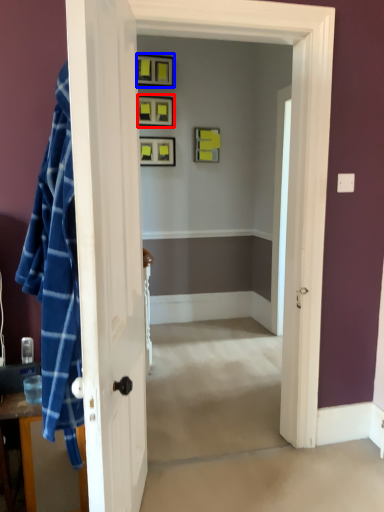
Question: Among these objects, which one is farthest to the camera, picture frame (highlighted by a red box) or picture frame (highlighted by a blue box)?

Choices:
 (A) picture frame
 (B) picture frame

Answer: (A)